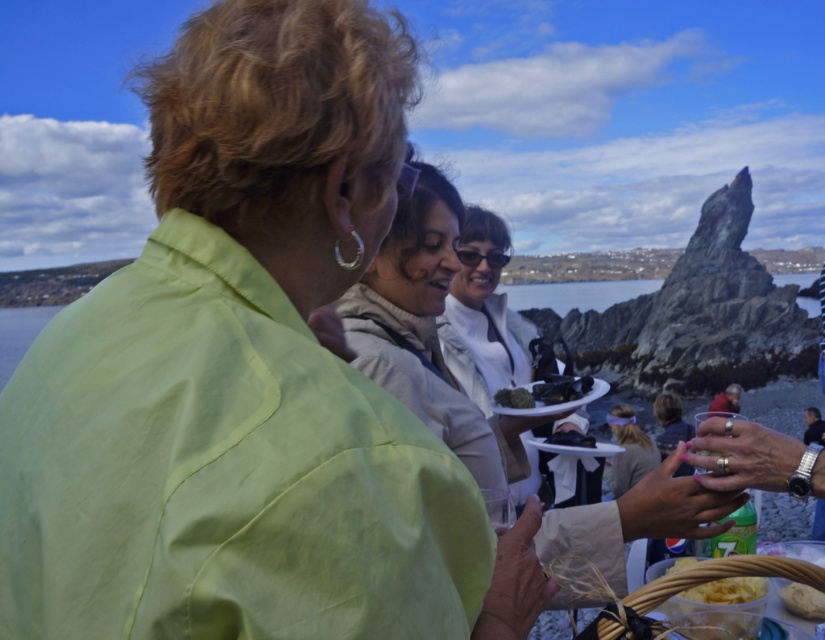
I want to click on light beige jacket at center, so click(x=418, y=323).

Between light beige jacket at center and smooth dark mussels at center, which one has more height?

light beige jacket at center is taller.

Is point (363, 276) behind point (547, 392)?

No, it is not.

Where is `light beige jacket at center`? light beige jacket at center is located at coordinates (418, 323).

Is translucent plastic container at lower right to the right of smooth dark mussels at center from the viewer's perspective?

Indeed, translucent plastic container at lower right is positioned on the right side of smooth dark mussels at center.

Can you confirm if translucent plastic container at lower right is positioned above smooth dark mussels at center?

Incorrect, translucent plastic container at lower right is not positioned above smooth dark mussels at center.

At what (x,y) coordinates should I click in order to perform the action: click on translucent plastic container at lower right. Please return your answer as a coordinate pair (x, y). This screenshot has width=825, height=640. Looking at the image, I should click on (724, 604).

Where is `translucent plastic container at lower right`? translucent plastic container at lower right is located at coordinates (724, 604).

From the picture: Is the position of translucent plastic container at lower right more distant than that of white matte bread at lower right?

That is False.

Does point (663, 611) come behind point (802, 588)?

That is True.

I want to click on translucent plastic container at lower right, so click(724, 604).

Where is `translucent plastic container at lower right`? The image size is (825, 640). translucent plastic container at lower right is located at coordinates pyautogui.click(x=724, y=604).